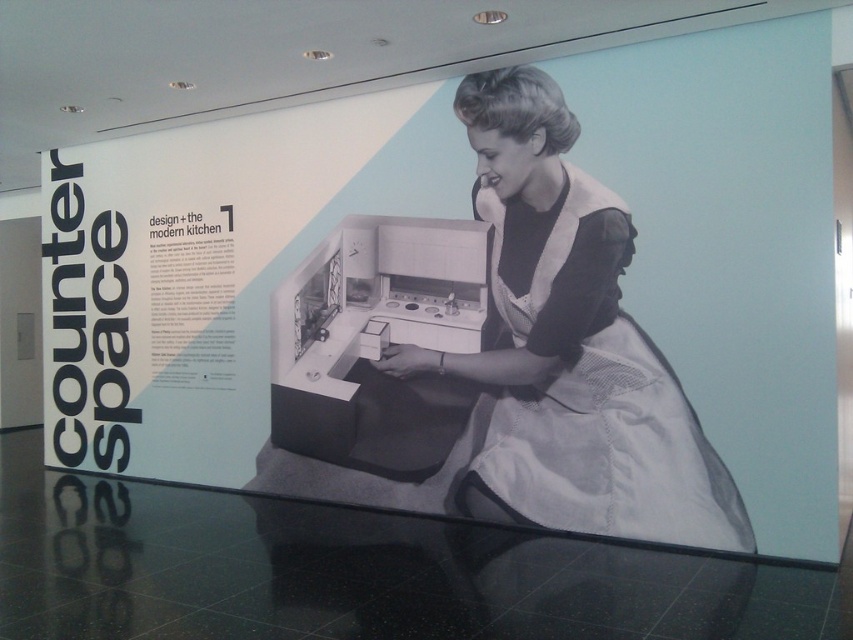
You are an art student standing in front of the exhibit. You want to sketch the black fabric apron at center and the metallic stove at center. Which object should you focus on first to capture its details accurately?

The black fabric apron at center is closer to the viewer than the metallic stove at center, so you should focus on the black fabric apron at center first to capture its details accurately.